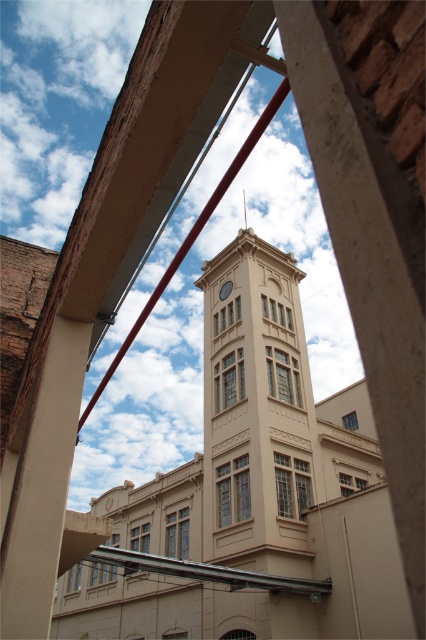
You are an architect analyzing the building structure. You notice the metallic clock at center and the smooth silver spire at upper center. Which of these two objects has a greater width when viewed from your current angle?

The metallic clock at center is thinner than the smooth silver spire at upper center, so the smooth silver spire at upper center has a greater width.

You are standing at the base of the beige stone clock tower at center and the metallic clock at center. Looking up, which object appears taller from your current viewpoint?

The beige stone clock tower at center appears taller than the metallic clock at center from your viewpoint.

You are standing in a courtyard between two buildings and looking up through a gap. You see the beige stone clock tower at center and the metallic clock at center. Which object is closer to the ground?

The beige stone clock tower at center is closer to the ground because it is positioned below the metallic clock at center.